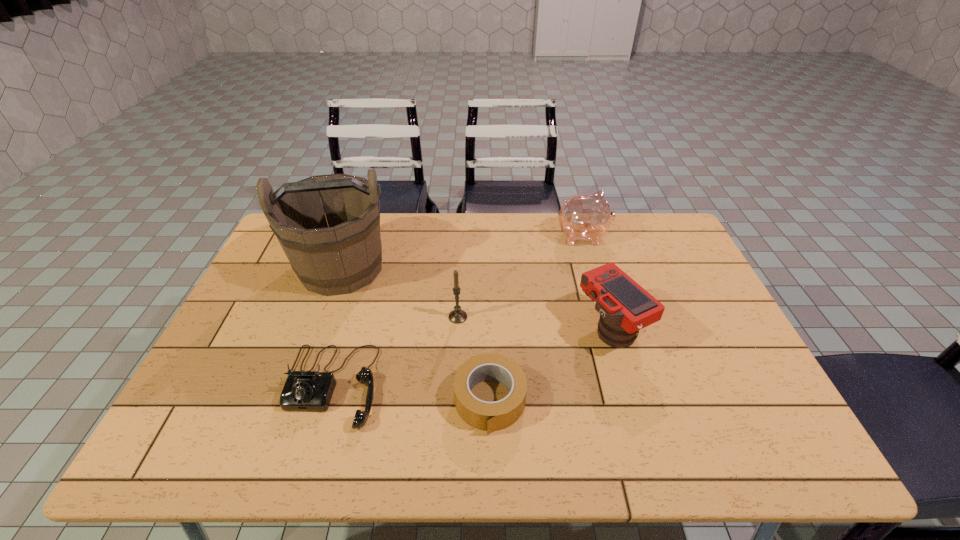
In order to click on object that is the third closest one to the piggy bank in this screenshot , I will do `click(488, 416)`.

Identify the location of the fourth closest object to the bucket. The image size is (960, 540). (587, 217).

Where is `vacant region that satisfies the following two spatial constraints: 1. on the back side of the candle; 2. on the front facing side of the piggy bank`? vacant region that satisfies the following two spatial constraints: 1. on the back side of the candle; 2. on the front facing side of the piggy bank is located at coordinates (462, 236).